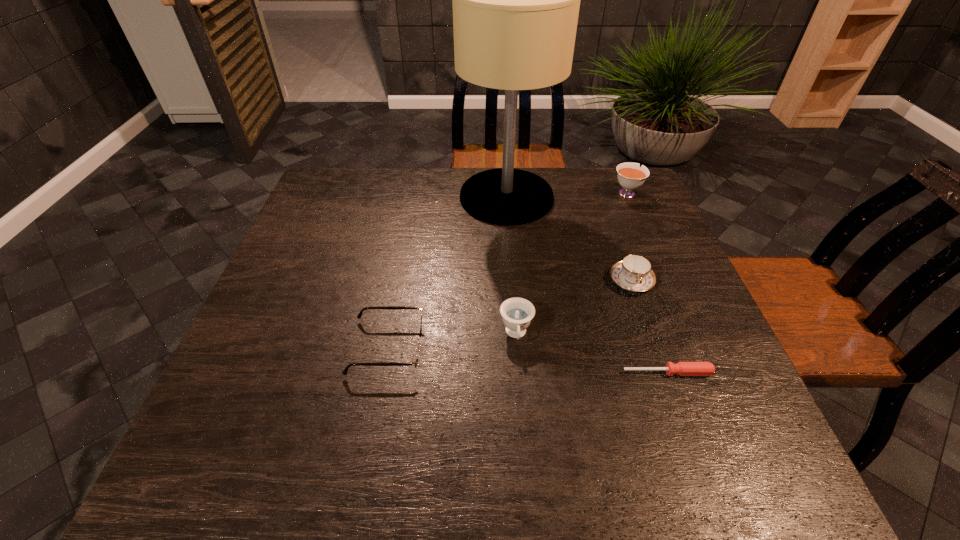
The width and height of the screenshot is (960, 540). Identify the location of table lamp. (516, 0).

Find the location of `the farthest teacup`. the farthest teacup is located at coordinates (631, 176).

At what (x,y) coordinates should I click in order to perform the action: click on the second tallest object. Please return your answer as a coordinate pair (x, y). This screenshot has height=540, width=960. Looking at the image, I should click on (631, 176).

Locate an element on the screen. the fourth shortest object is located at coordinates 517,313.

Identify the location of the nearest teacup. This screenshot has height=540, width=960. (517, 313).

Identify the location of the shortest teacup. (634, 273).

The width and height of the screenshot is (960, 540). I want to click on the third farthest object, so click(634, 273).

Locate an element on the screen. spectacles is located at coordinates (416, 355).

This screenshot has width=960, height=540. What are the coordinates of `screwdriver` in the screenshot? It's located at (681, 368).

Locate an element on the screen. free location located 0.290m on the front of the table lamp is located at coordinates (515, 302).